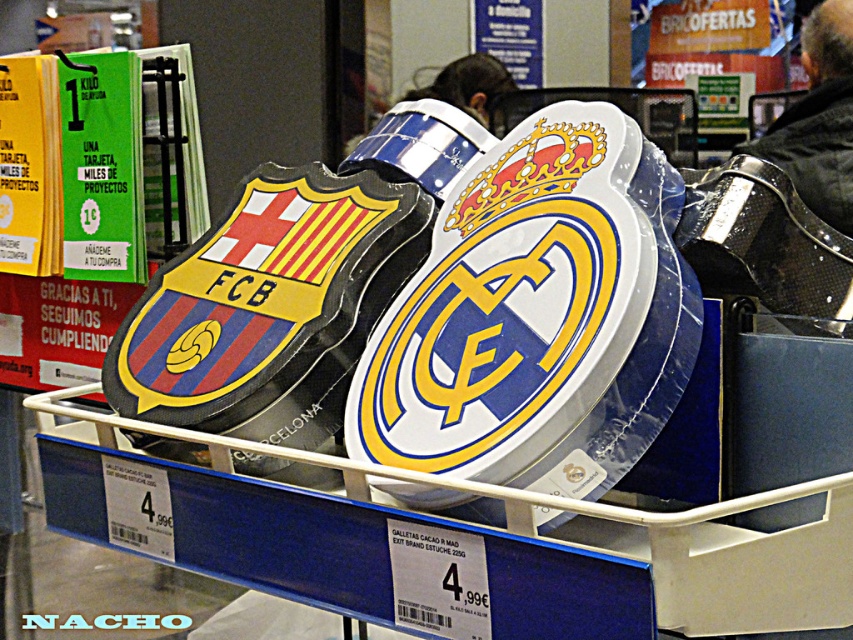
Question: Can you confirm if white glossy shield at center is positioned to the right of black leather jacket at upper right?

Choices:
 (A) yes
 (B) no

Answer: (B)

Question: Which of the following is the closest to the observer?

Choices:
 (A) (831, 33)
 (B) (517, 369)

Answer: (B)

Question: Among these objects, which one is nearest to the camera?

Choices:
 (A) white glossy shield at center
 (B) black leather jacket at upper right

Answer: (A)

Question: Does white glossy shield at center have a greater width compared to black leather jacket at upper right?

Choices:
 (A) yes
 (B) no

Answer: (A)

Question: Is the position of white glossy shield at center more distant than that of black leather jacket at upper right?

Choices:
 (A) no
 (B) yes

Answer: (A)